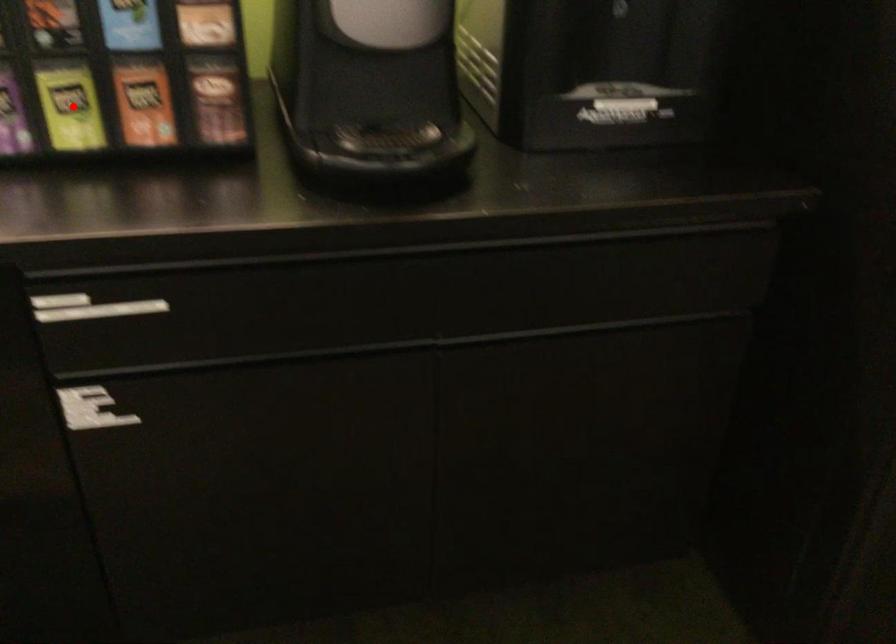
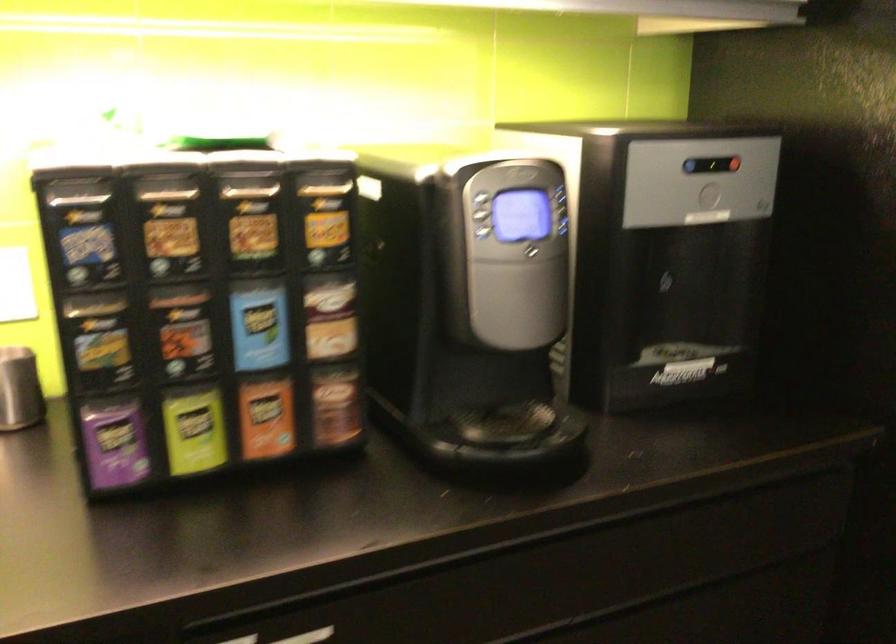
Where in the second image is the point corresponding to the highlighted location from the first image?

(194, 430)